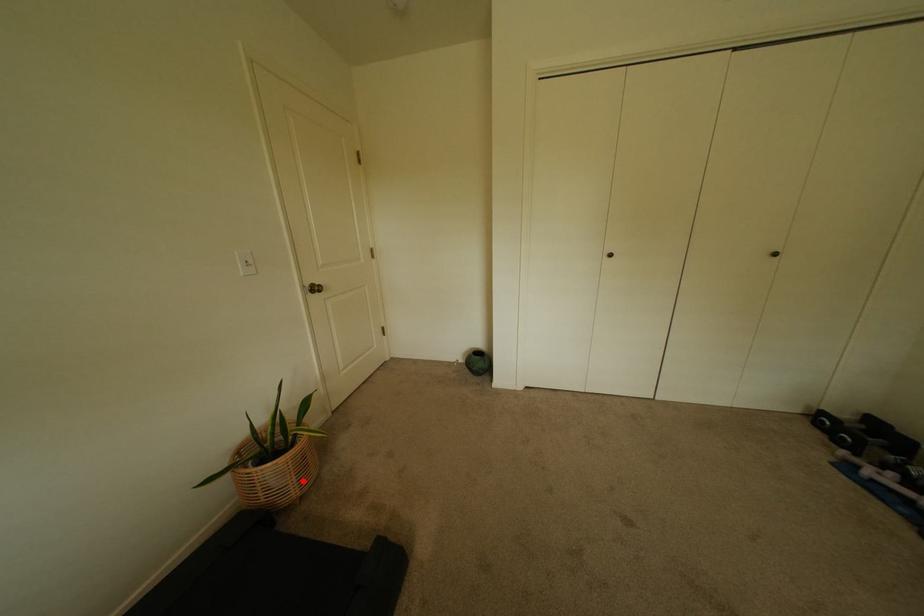
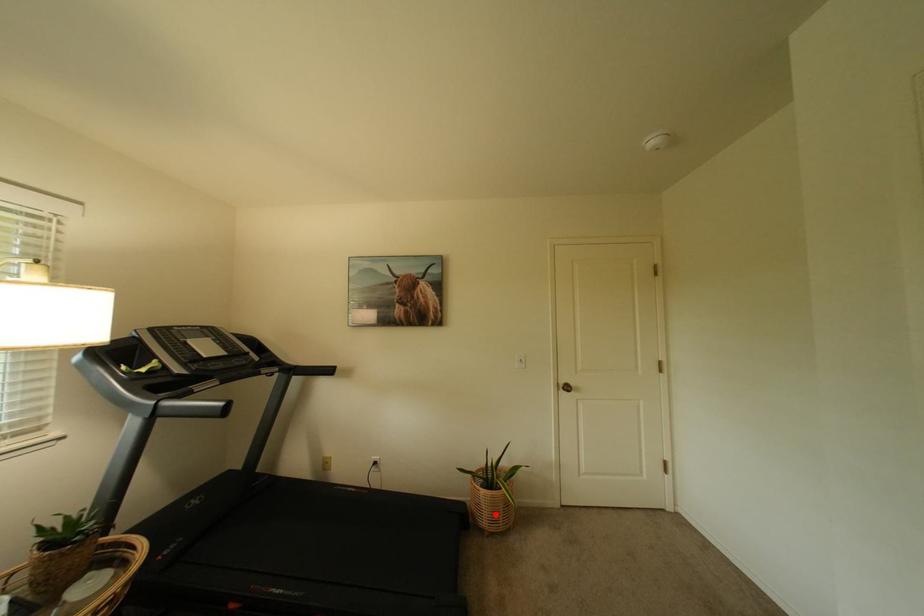
I am providing you with two images of the same scene from different viewpoints. A red point is marked on the first image and another point is marked on the second image. Do the highlighted points in image1 and image2 indicate the same real-world spot?

Yes